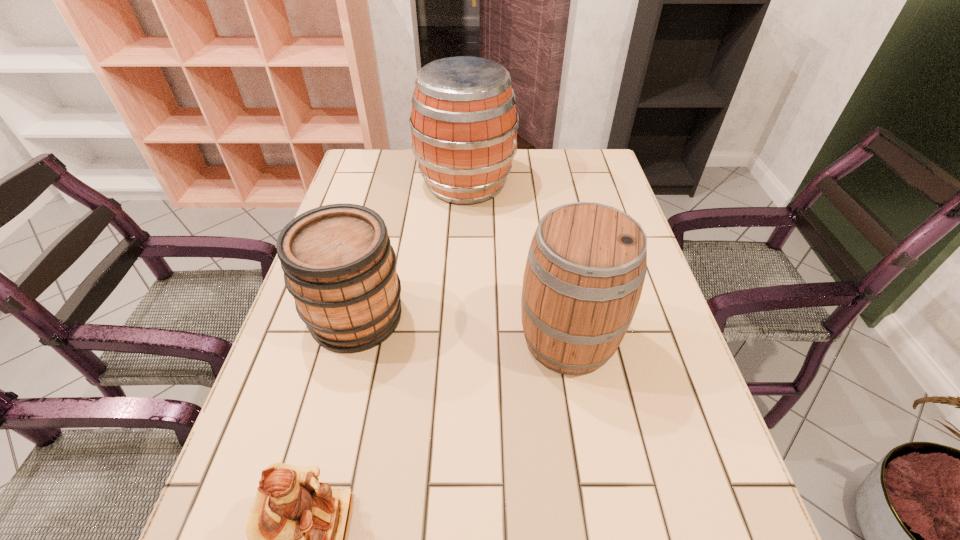
This screenshot has height=540, width=960. I want to click on the farthest object, so tap(464, 123).

I want to click on the second tallest object, so click(587, 262).

Where is `the shortest cider`? The height and width of the screenshot is (540, 960). the shortest cider is located at coordinates (339, 266).

This screenshot has width=960, height=540. In order to click on vacant space situated on the left of the farthest cider in this screenshot , I will do `click(382, 183)`.

The height and width of the screenshot is (540, 960). What are the coordinates of `free spot located on the back of the second tallest object` in the screenshot? It's located at (554, 259).

Find the location of a particular element. free region located on the right of the shortest cider is located at coordinates (559, 317).

Where is `object located in the far edge section of the desktop`? This screenshot has height=540, width=960. object located in the far edge section of the desktop is located at coordinates (464, 123).

Where is `object present at the left edge`? Image resolution: width=960 pixels, height=540 pixels. object present at the left edge is located at coordinates (339, 266).

This screenshot has width=960, height=540. I want to click on object that is at the right edge, so click(x=587, y=262).

Where is `free space at the far edge of the desktop`? This screenshot has width=960, height=540. free space at the far edge of the desktop is located at coordinates (419, 187).